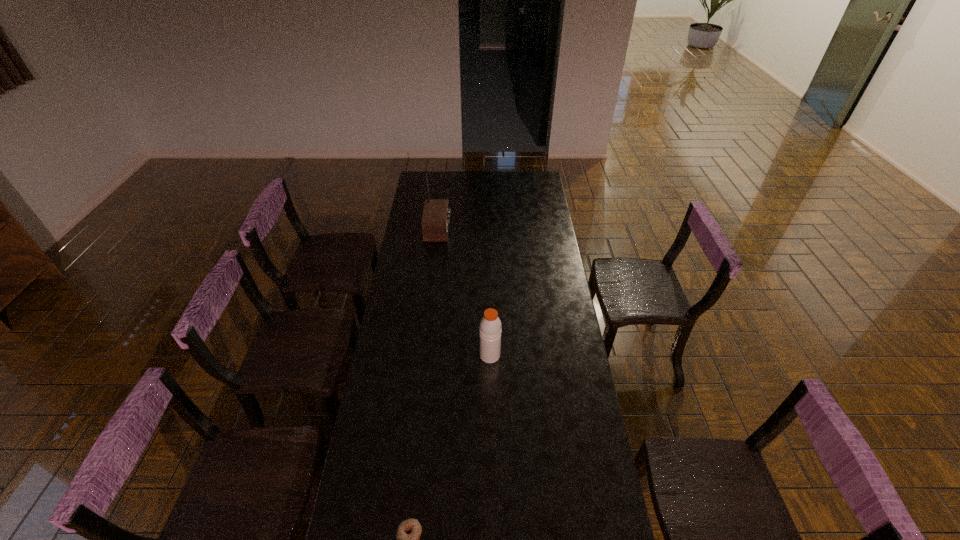
Find the location of a particular element. Image resolution: width=960 pixels, height=540 pixels. free spot between the shaker and the radio receiver is located at coordinates (464, 293).

Where is `vacant space in between the second shortest object and the farthest object`? Image resolution: width=960 pixels, height=540 pixels. vacant space in between the second shortest object and the farthest object is located at coordinates (464, 293).

Where is `the second closest object to the second nearest object`? The width and height of the screenshot is (960, 540). the second closest object to the second nearest object is located at coordinates (435, 219).

Identify the location of object that stands as the second closest to the nearest object. The image size is (960, 540). (435, 219).

I want to click on vacant region that satisfies the following two spatial constraints: 1. on the back side of the second nearest object; 2. on the front-facing side of the farthest object, so click(x=488, y=230).

Find the location of a particular element. free space that satisfies the following two spatial constraints: 1. on the front-facing side of the radio receiver; 2. on the right side of the second farthest object is located at coordinates (423, 355).

Find the location of `vacant area in the image that satisfies the following two spatial constraints: 1. on the front-facing side of the radio receiver; 2. on the back side of the second tallest object`. vacant area in the image that satisfies the following two spatial constraints: 1. on the front-facing side of the radio receiver; 2. on the back side of the second tallest object is located at coordinates (423, 355).